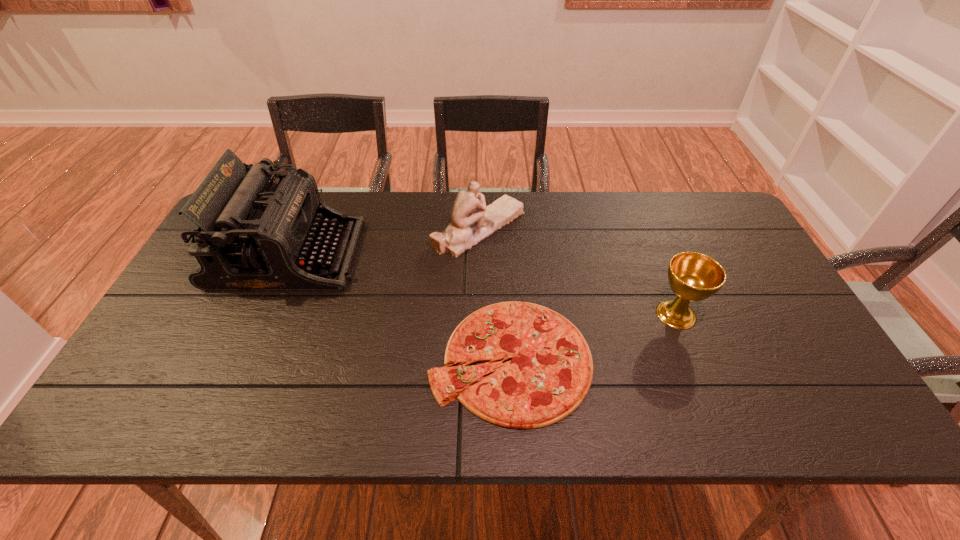
The height and width of the screenshot is (540, 960). In order to click on free space between the rightmost object and the figurine in this screenshot , I will do `click(578, 271)`.

Where is `blank region between the tallest object and the chalice`? blank region between the tallest object and the chalice is located at coordinates (483, 285).

This screenshot has height=540, width=960. I want to click on empty location between the tallest object and the figurine, so click(x=384, y=241).

Where is `vacant point located between the chalice and the typewriter`? This screenshot has height=540, width=960. vacant point located between the chalice and the typewriter is located at coordinates (483, 285).

You are a GUI agent. You are given a task and a screenshot of the screen. Output one action in this format:
    pyautogui.click(x=<x>, y=<y>)
    Task: Click on the empty location between the rightmost object and the tallest object
    Image resolution: width=960 pixels, height=540 pixels.
    Given the screenshot: What is the action you would take?
    pyautogui.click(x=483, y=285)

Locate an element on the screen. Image resolution: width=960 pixels, height=540 pixels. free spot between the pizza and the figurine is located at coordinates (x=494, y=294).

Locate an element on the screen. This screenshot has width=960, height=540. empty space between the figurine and the rightmost object is located at coordinates (578, 271).

Where is `free spot between the figurine and the pizza`? The width and height of the screenshot is (960, 540). free spot between the figurine and the pizza is located at coordinates (494, 294).

You are a GUI agent. You are given a task and a screenshot of the screen. Output one action in this format:
    pyautogui.click(x=<x>, y=<y>)
    Task: Click on the blank region between the typewriter and the figurine
    
    Given the screenshot: What is the action you would take?
    pyautogui.click(x=384, y=241)

What are the coordinates of `the second closest object to the rightmost object` in the screenshot? It's located at (472, 221).